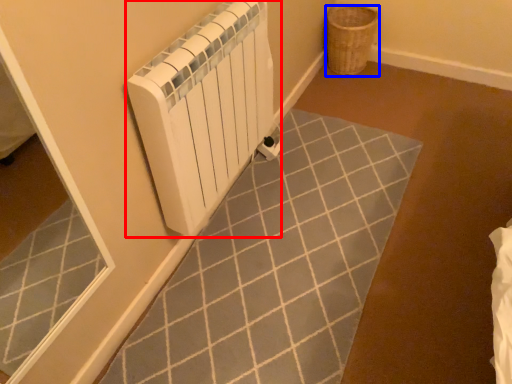
Question: Which point is further to the camera, bath heater (highlighted by a red box) or basket (highlighted by a blue box)?

Choices:
 (A) bath heater
 (B) basket

Answer: (B)